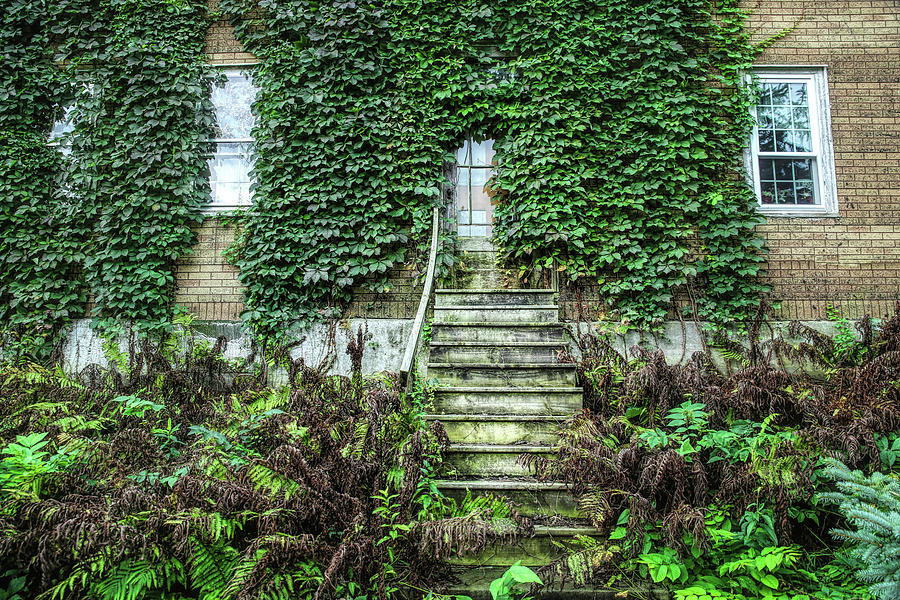
This screenshot has width=900, height=600. What are the coordinates of `glass panes` in the screenshot? It's located at (779, 133), (225, 110), (230, 179), (481, 185).